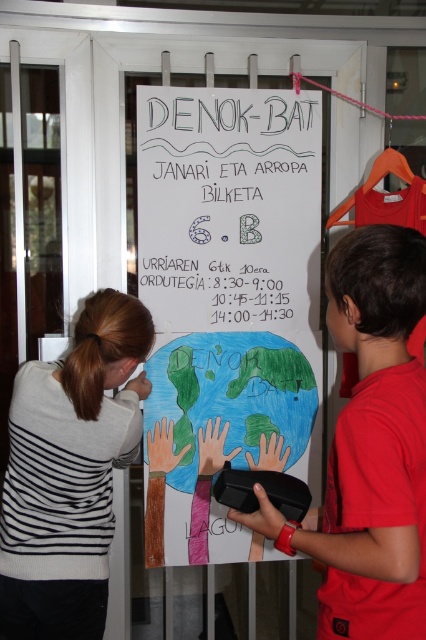
You are holding a camera and want to take a photo of the white paper at center. The camera requires a minimum distance of 2 meters to focus properly. Can you take a clear photo from your current position?

The white paper at center and camera are 1.97 meters apart from each other, so you are too close to take a clear photo. Move back to ensure the camera is at least 2 meters away to focus properly.

You are organizing an event and need to place two posters on a door. You have a white paper at center and a black paper at center. According to the scene, which poster should you place first if you want the larger one to be more visible?

The white paper at center is bigger than the black paper at center, so you should place the white paper at center first to ensure it is more visible.

What is the relationship between the size of the white paper at center and the red matte shirt at right in the scene?

The white paper at center has a larger size compared to the red matte shirt at right.